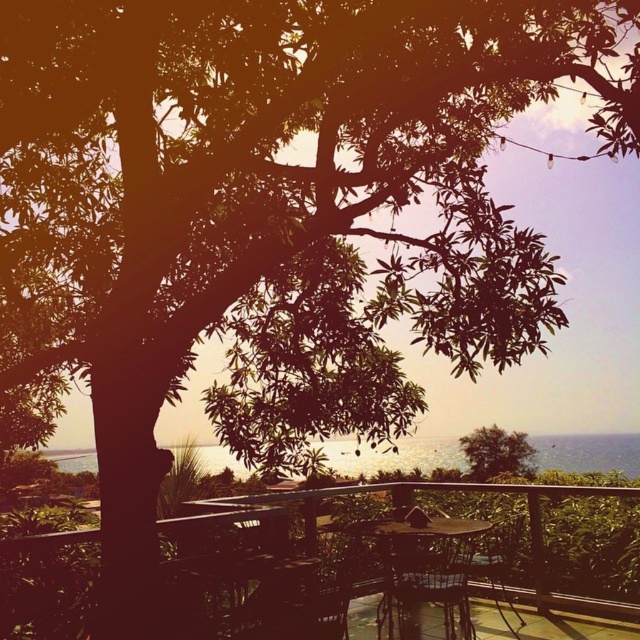
Question: Considering the relative positions of wooden table at center and metallic brown table at center in the image provided, where is wooden table at center located with respect to metallic brown table at center?

Choices:
 (A) above
 (B) below

Answer: (A)

Question: Which point appears closest to the camera in this image?

Choices:
 (A) (577, 490)
 (B) (451, 637)
 (C) (497, 577)
 (D) (534, 449)

Answer: (B)

Question: Considering the real-world distances, which object is farthest from the metallic brown table at center?

Choices:
 (A) wooden chair at center
 (B) green leafy tree at center
 (C) wooden table at center

Answer: (B)

Question: Which of the following is the farthest from the observer?

Choices:
 (A) (417, 552)
 (B) (496, 472)
 (C) (522, 618)

Answer: (B)

Question: Does green leafy tree at center appear over wooden chair at center?

Choices:
 (A) no
 (B) yes

Answer: (A)

Question: Considering the relative positions of metallic brown table at center and wooden chair at center in the image provided, where is metallic brown table at center located with respect to wooden chair at center?

Choices:
 (A) left
 (B) right

Answer: (A)